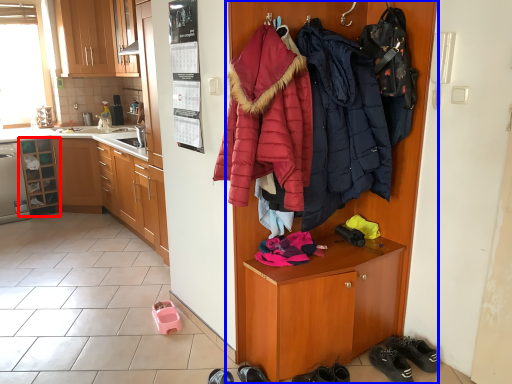
Question: Which of the following is the farthest to the observer, cabinetry (highlighted by a red box) or cupboard (highlighted by a blue box)?

Choices:
 (A) cabinetry
 (B) cupboard

Answer: (A)